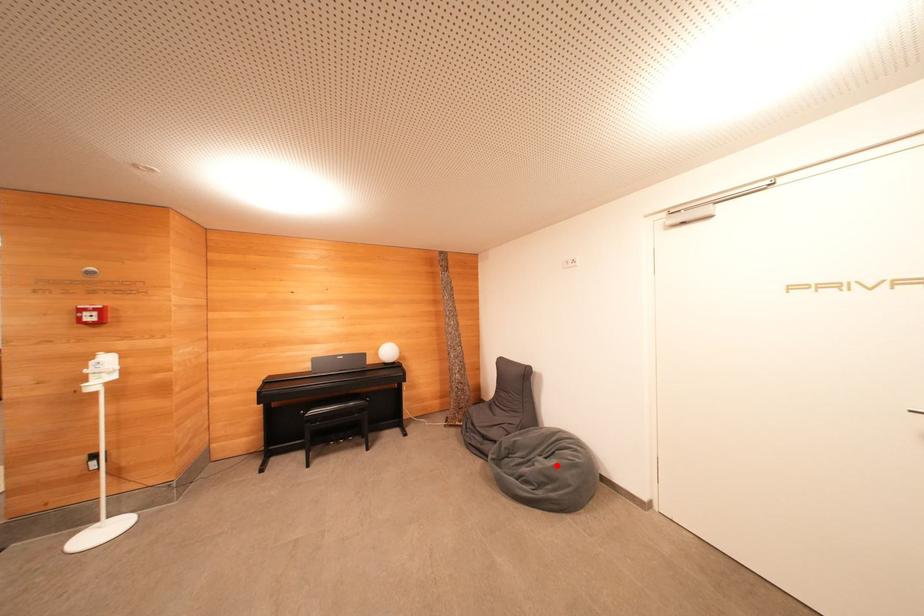
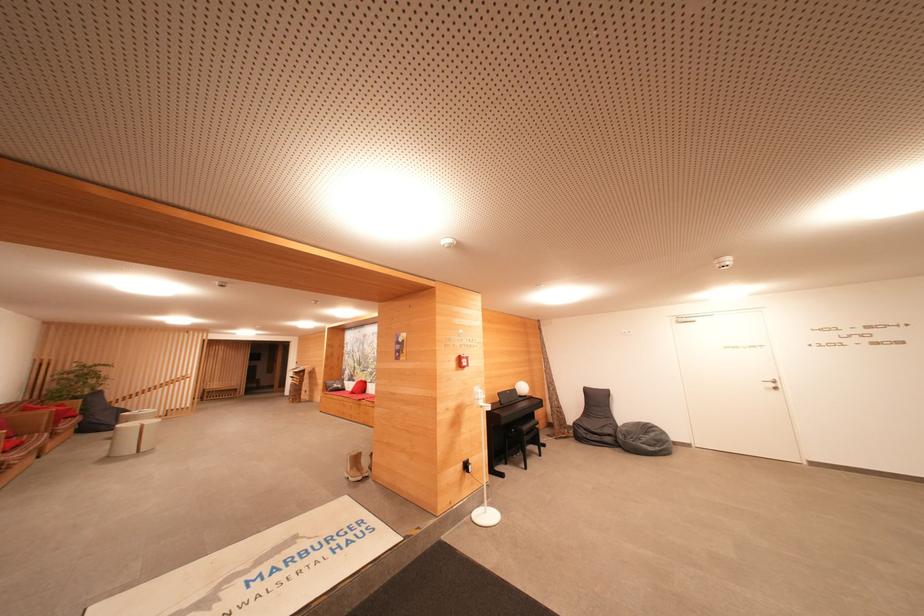
Question: A red point is marked in image1. In image2, is the corresponding 3D point closer to the camera or farther? Reply with the corresponding letter.

Choices:
 (A) The corresponding 3D point is closer.
 (B) The corresponding 3D point is farther.

Answer: (B)